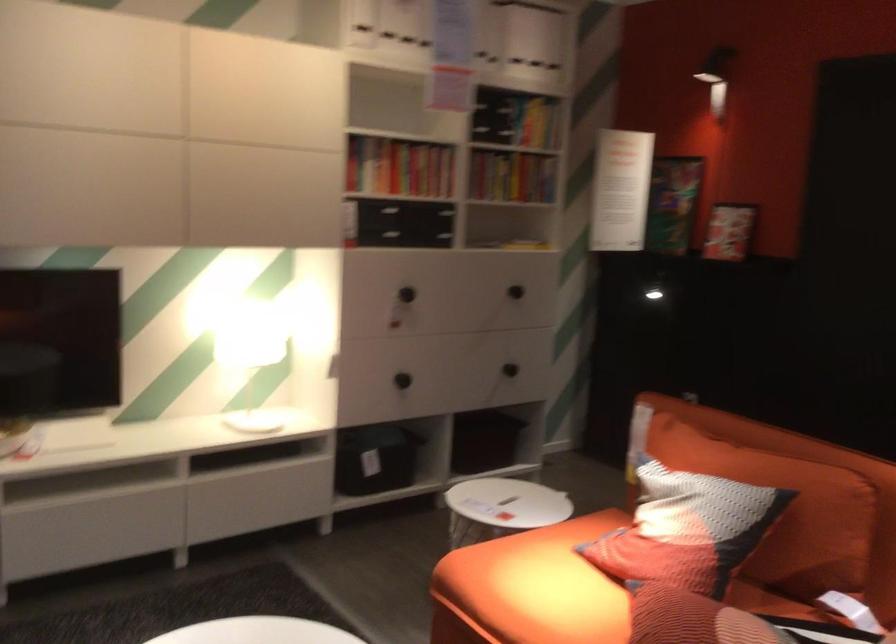
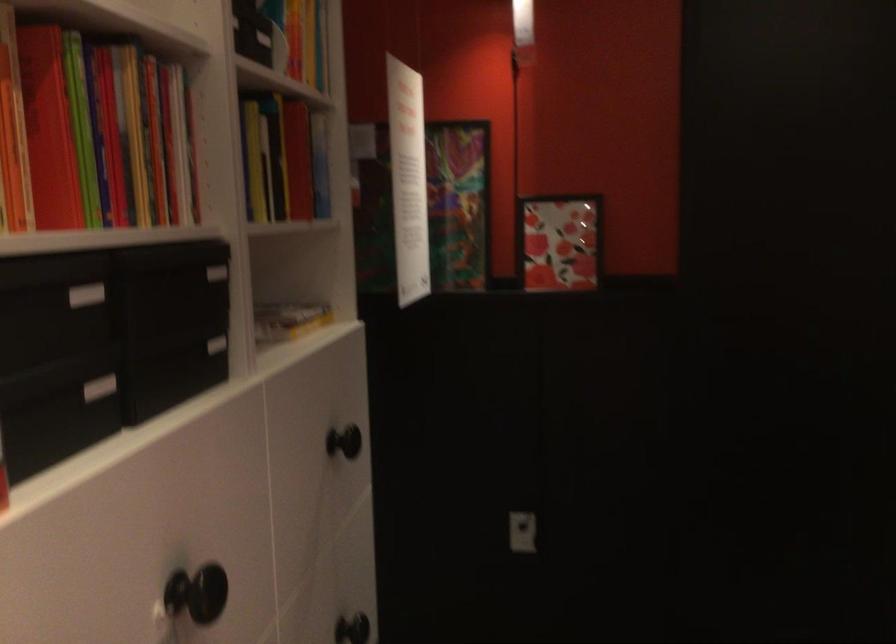
The point at (x=523, y=154) is marked in the first image. Where is the corresponding point in the second image?

(282, 158)